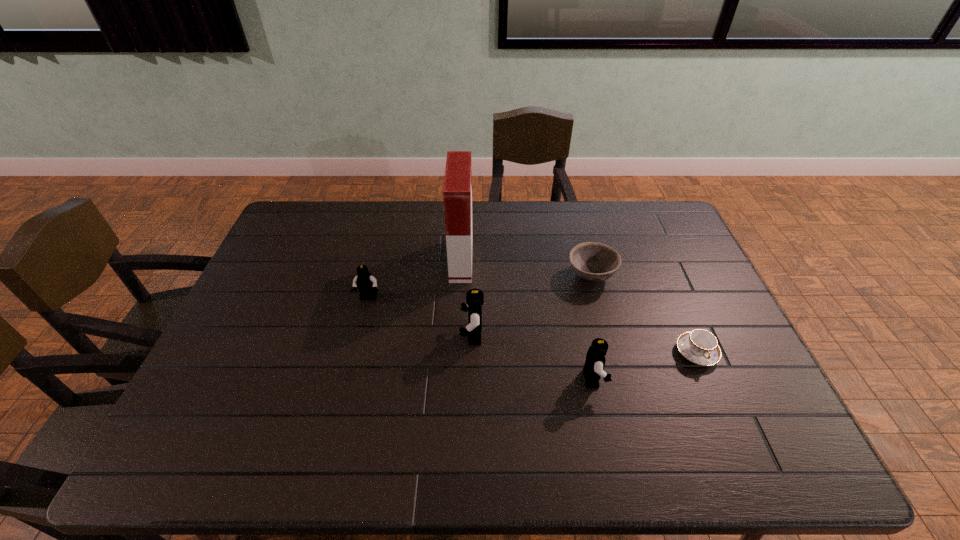
Identify the location of free point that satisfies the following two spatial constraints: 1. on the front-facing side of the cigarette_case; 2. on the front-facing side of the leftmost object. The width and height of the screenshot is (960, 540). (460, 299).

Find the location of a particular element. The height and width of the screenshot is (540, 960). blank space that satisfies the following two spatial constraints: 1. on the side with the handle of the rightmost object; 2. on the front-facing side of the rightmost Lego is located at coordinates (708, 379).

Find the location of a particular element. Image resolution: width=960 pixels, height=540 pixels. vacant region that satisfies the following two spatial constraints: 1. on the side with the handle of the rightmost object; 2. on the front-facing side of the second tallest Lego is located at coordinates (708, 379).